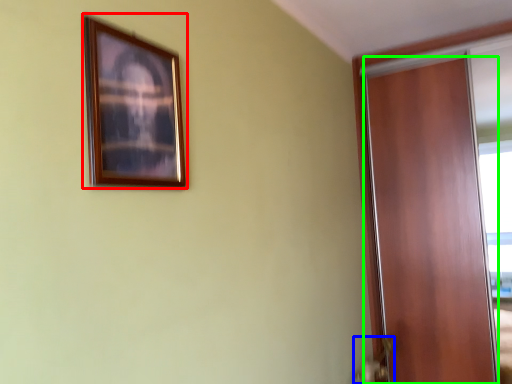
Question: Which is farther away from picture frame (highlighted by a red box)? door handle (highlighted by a blue box) or door (highlighted by a green box)?

Choices:
 (A) door handle
 (B) door

Answer: (B)